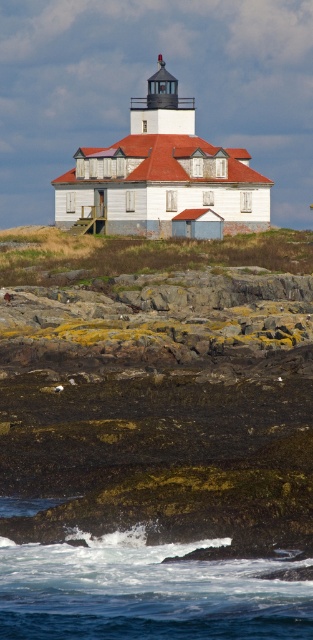
Between white frothy water at lower center and white wooden lighthouse at center, which one appears on the right side from the viewer's perspective?

Positioned to the right is white frothy water at lower center.

Measure the distance between white frothy water at lower center and white wooden lighthouse at center.

white frothy water at lower center and white wooden lighthouse at center are 245.79 feet apart.

Where is `white frothy water at lower center`? white frothy water at lower center is located at coordinates (145, 593).

Where is `white frothy water at lower center`? The width and height of the screenshot is (313, 640). white frothy water at lower center is located at coordinates (145, 593).